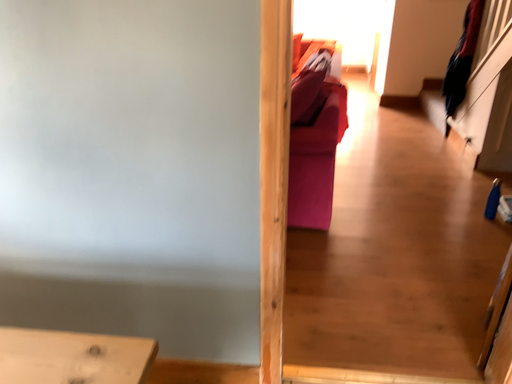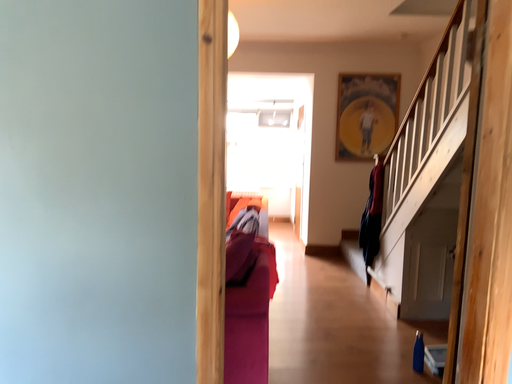
Question: How did the camera likely rotate when shooting the video?

Choices:
 (A) rotated left
 (B) rotated right

Answer: (B)